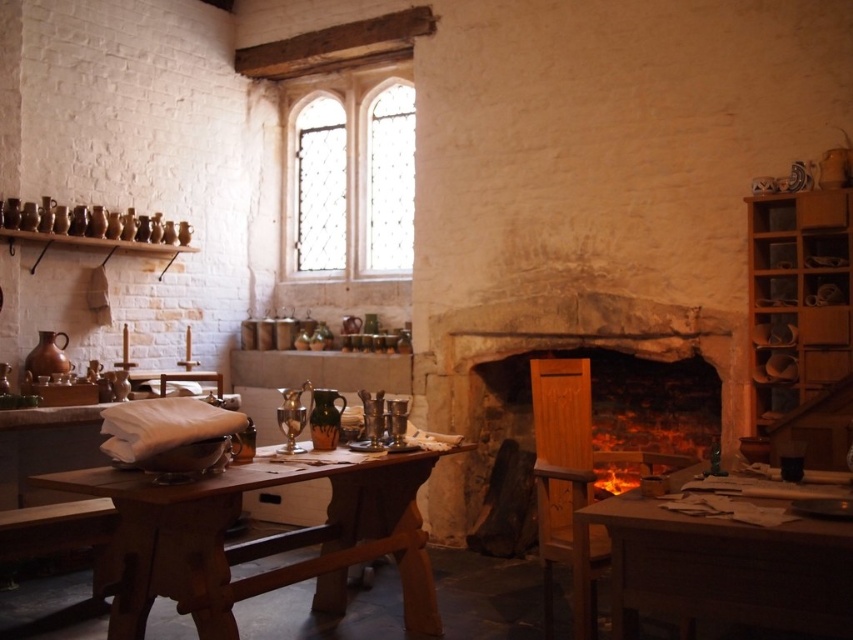
In the scene shown: Measure the distance between wooden table at lower right and wooden shelves at right.

The distance of wooden table at lower right from wooden shelves at right is 6.34 feet.

Is the position of wooden table at lower right less distant than that of wooden shelves at right?

Yes, it is in front of wooden shelves at right.

Who is more forward, [810,540] or [814,301]?

Point [810,540] is in front.

I want to click on wooden table at lower right, so click(715, 570).

Does point (343, 483) come farther from viewer compared to point (302, 148)?

That is False.

Does brown wooden table at lower left appear over clear glass window at upper center?

No, brown wooden table at lower left is not above clear glass window at upper center.

Is point (300, 470) positioned after point (344, 109)?

No.

Locate an element on the screen. The height and width of the screenshot is (640, 853). brown wooden table at lower left is located at coordinates (259, 540).

Which of these two, brown wooden table at lower left or wooden table at lower right, stands taller?

brown wooden table at lower left

Measure the distance between point (106, 564) and camera.

Point (106, 564) and camera are 12.24 feet apart from each other.

Identify the location of brown wooden table at lower left. The image size is (853, 640). (259, 540).